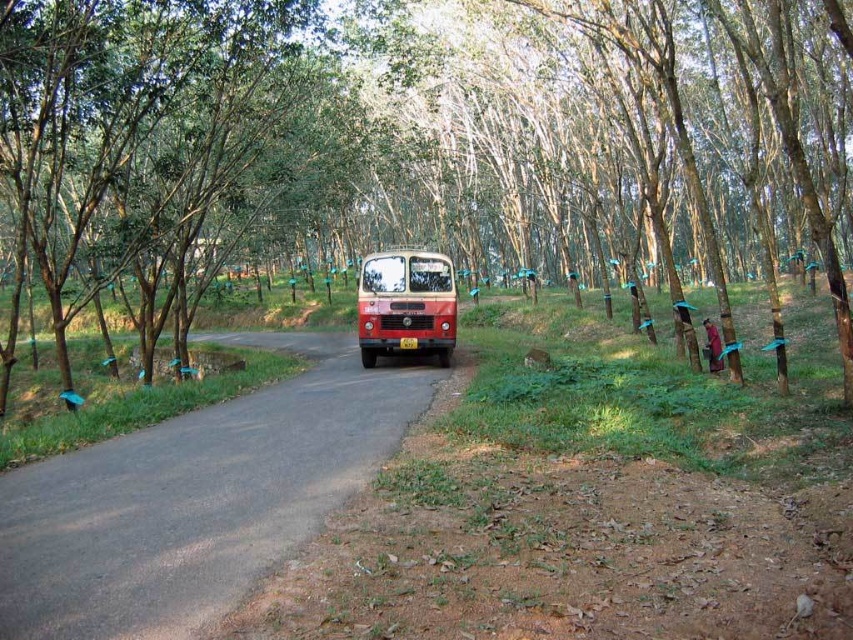
Question: Which point is closer to the camera taking this photo?

Choices:
 (A) (149, 244)
 (B) (395, 340)
 (C) (259, 560)

Answer: (C)

Question: Is brown smooth tree at center closer to the viewer compared to smooth asphalt road at center?

Choices:
 (A) no
 (B) yes

Answer: (A)

Question: Is the position of brown smooth tree at center less distant than that of smooth asphalt road at center?

Choices:
 (A) yes
 (B) no

Answer: (B)

Question: Which of the following is the farthest from the observer?

Choices:
 (A) (376, 269)
 (B) (86, 81)

Answer: (A)

Question: Which of the following is the farthest from the observer?

Choices:
 (A) (717, 193)
 (B) (456, 308)
 (C) (71, 461)

Answer: (A)

Question: Can you confirm if brown smooth tree at center is positioned below smooth asphalt road at center?

Choices:
 (A) no
 (B) yes

Answer: (A)